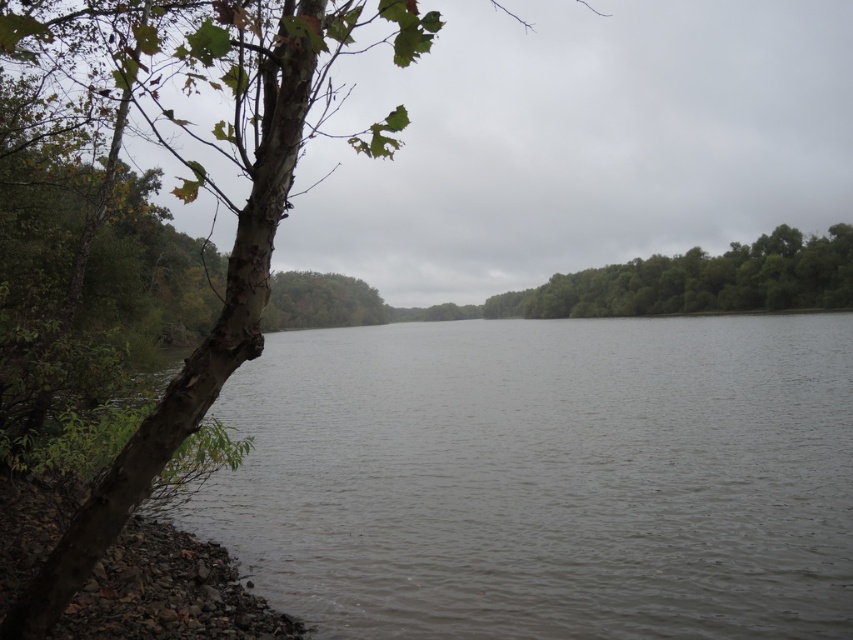
Question: Is green rough bark tree at left below rocks at lower left?

Choices:
 (A) yes
 (B) no

Answer: (B)

Question: Is green rough bark tree at left in front of green leafy trees at center?

Choices:
 (A) yes
 (B) no

Answer: (A)

Question: In this image, where is gray water at center located relative to green rough bark tree at left?

Choices:
 (A) left
 (B) right

Answer: (B)

Question: Which point is farther to the camera?

Choices:
 (A) rocks at lower left
 (B) gray water at center

Answer: (B)

Question: Which of the following is the farthest from the observer?

Choices:
 (A) [x=576, y=276]
 (B) [x=140, y=608]
 (C) [x=260, y=157]

Answer: (A)

Question: Estimate the real-world distances between objects in this image. Which object is closer to the green rough bark tree at left?

Choices:
 (A) rocks at lower left
 (B) gray water at center

Answer: (B)